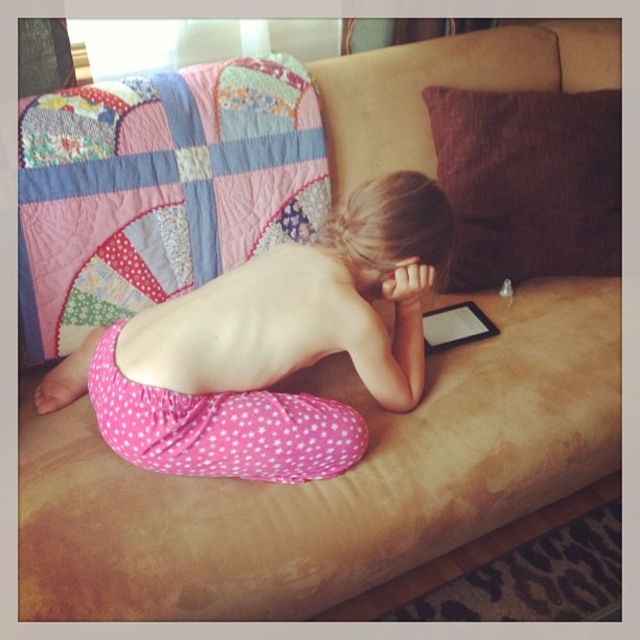
Is pink polka dot pants at center to the right of pink polka dot fabric at lower center from the viewer's perspective?

Indeed, pink polka dot pants at center is positioned on the right side of pink polka dot fabric at lower center.

Locate an element on the screen. This screenshot has width=640, height=640. pink polka dot pants at center is located at coordinates (269, 348).

Locate an element on the screen. The image size is (640, 640). pink polka dot pants at center is located at coordinates (269, 348).

Does brown cotton pillow at upper right have a larger size compared to black matte tablet at center?

Indeed, brown cotton pillow at upper right has a larger size compared to black matte tablet at center.

Does brown cotton pillow at upper right have a lesser height compared to black matte tablet at center?

No.

At what (x,y) coordinates should I click in order to perform the action: click on brown cotton pillow at upper right. Please return your answer as a coordinate pair (x, y). The width and height of the screenshot is (640, 640). Looking at the image, I should click on (529, 182).

Is point (19, 269) in front of point (428, 321)?

Yes, point (19, 269) is closer to viewer.

Identify the location of patchwork fabric quilt at upper left. (157, 188).